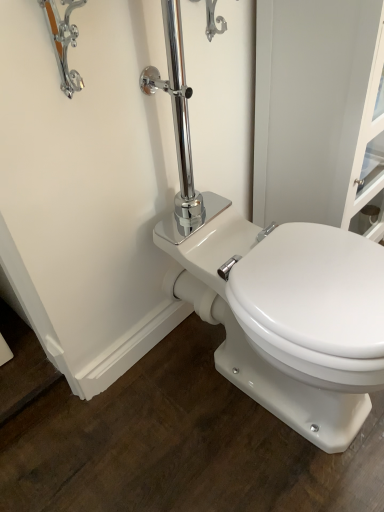
Question: Is white glossy screen door at upper right wider or thinner than white glossy porcelain toilet at center?

Choices:
 (A) thin
 (B) wide

Answer: (A)

Question: From a real-world perspective, is white glossy screen door at upper right physically located above or below white glossy porcelain toilet at center?

Choices:
 (A) above
 (B) below

Answer: (A)

Question: Based on their relative distances, which object is farther from the white glossy porcelain toilet at center?

Choices:
 (A) chrome metallic faucet at upper left
 (B) white glossy screen door at upper right

Answer: (A)

Question: Estimate the real-world distances between objects in this image. Which object is closer to the white glossy porcelain toilet at center?

Choices:
 (A) white glossy screen door at upper right
 (B) chrome metallic faucet at upper left

Answer: (A)